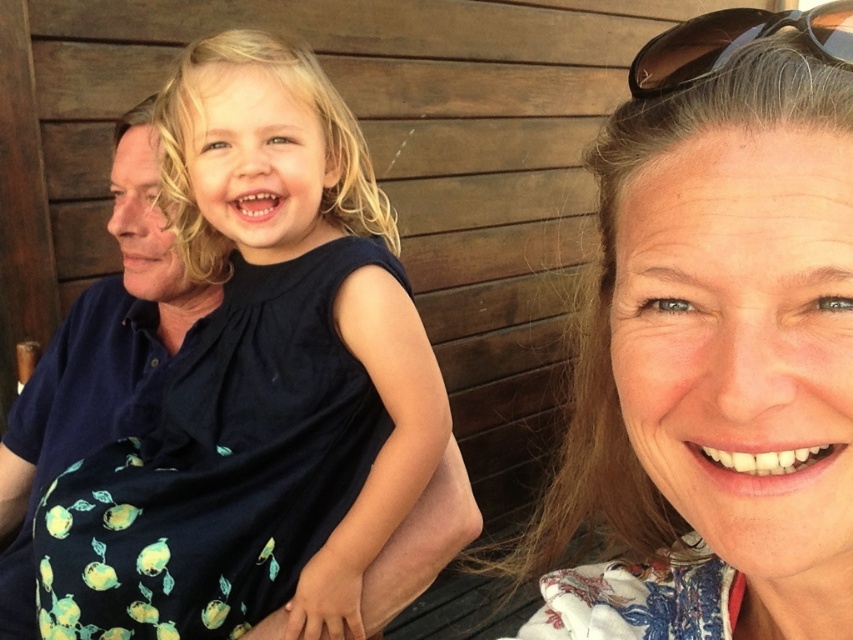
What do you see at coordinates (717, 348) in the screenshot?
I see `floral fabric at upper right` at bounding box center [717, 348].

Is floral fabric at upper right positioned behind black plastic sunglasses at upper right?

No, it is in front of black plastic sunglasses at upper right.

Image resolution: width=853 pixels, height=640 pixels. I want to click on floral fabric at upper right, so 717,348.

Identify the location of floral fabric at upper right. (717, 348).

Is point (328, 627) closer to viewer compared to point (695, 58)?

No, it is not.

Can you confirm if dark blue fabric dress at center is positioned to the right of black plastic sunglasses at upper right?

No, dark blue fabric dress at center is not to the right of black plastic sunglasses at upper right.

The width and height of the screenshot is (853, 640). What do you see at coordinates (260, 384) in the screenshot?
I see `dark blue fabric dress at center` at bounding box center [260, 384].

The image size is (853, 640). I want to click on dark blue fabric dress at center, so click(x=260, y=384).

Who is more forward, (645,369) or (357,218)?

Point (645,369) is more forward.

Is floral fabric at upper right positioned before dark blue fabric dress at center?

Yes, floral fabric at upper right is in front of dark blue fabric dress at center.

This screenshot has height=640, width=853. I want to click on floral fabric at upper right, so click(x=717, y=348).